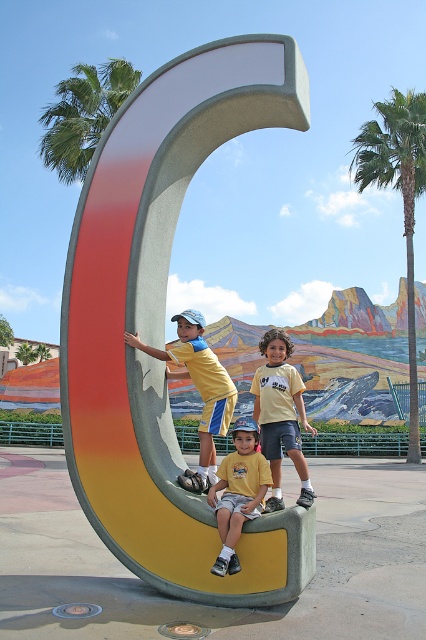
Find the location of a particular element. The image size is (426, 640). matte concrete letter c at center is located at coordinates (164, 323).

Is matte concrete letter c at center above green leafy palm tree at upper right?

Actually, matte concrete letter c at center is below green leafy palm tree at upper right.

What are the coordinates of `matte concrete letter c at center` in the screenshot? It's located at (164, 323).

Does matte concrete letter c at center lie behind yellow matte shorts at center?

No, matte concrete letter c at center is closer to the viewer.

Image resolution: width=426 pixels, height=640 pixels. I want to click on matte concrete letter c at center, so click(164, 323).

What are the coordinates of `matte concrete letter c at center` in the screenshot? It's located at (164, 323).

Is green leafy palm tree at upper left wider than yellow matte shorts at center?

Yes, green leafy palm tree at upper left is wider than yellow matte shorts at center.

Does green leafy palm tree at upper left have a lesser height compared to yellow matte shorts at center?

No.

The height and width of the screenshot is (640, 426). I want to click on green leafy palm tree at upper left, so click(83, 115).